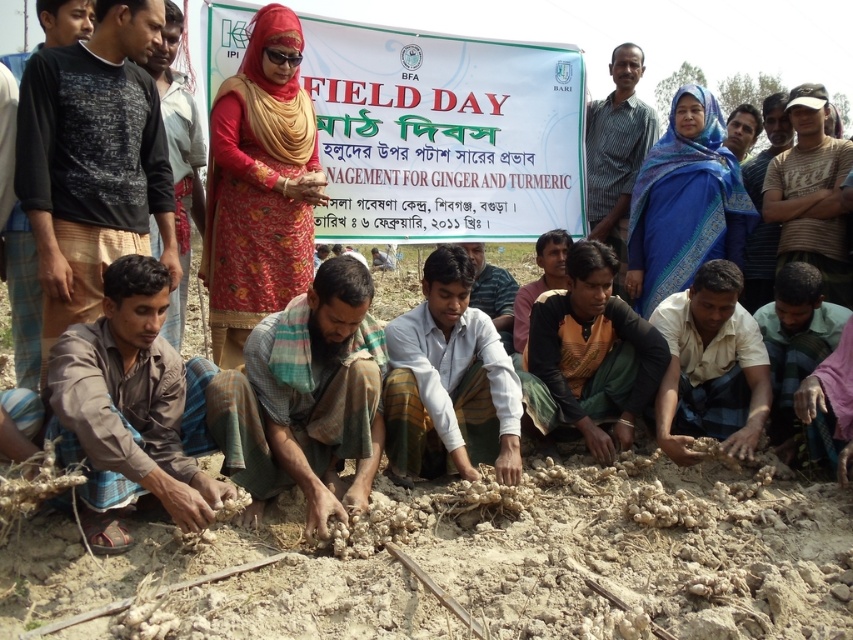
Question: Which point is farther to the camera?

Choices:
 (A) (289, 348)
 (B) (228, 188)
 (C) (155, 314)
 (D) (689, 300)

Answer: (D)

Question: Which of the following is the closest to the observer?

Choices:
 (A) brown plaid shirt at lower left
 (B) white paper banner at center

Answer: (A)

Question: Can you confirm if white paper banner at center is thinner than brown fabric shirt at center?

Choices:
 (A) no
 (B) yes

Answer: (A)

Question: Is white paper banner at center below brown woven cloth at center?

Choices:
 (A) no
 (B) yes

Answer: (A)

Question: Observing the image, what is the correct spatial positioning of white paper banner at center in reference to brown woven cloth at center?

Choices:
 (A) below
 (B) above

Answer: (B)

Question: Which of the following is the farthest from the observer?

Choices:
 (A) brown woven cloth at center
 (B) brown plaid shirt at lower left
 (C) white cotton shirt at center

Answer: (C)